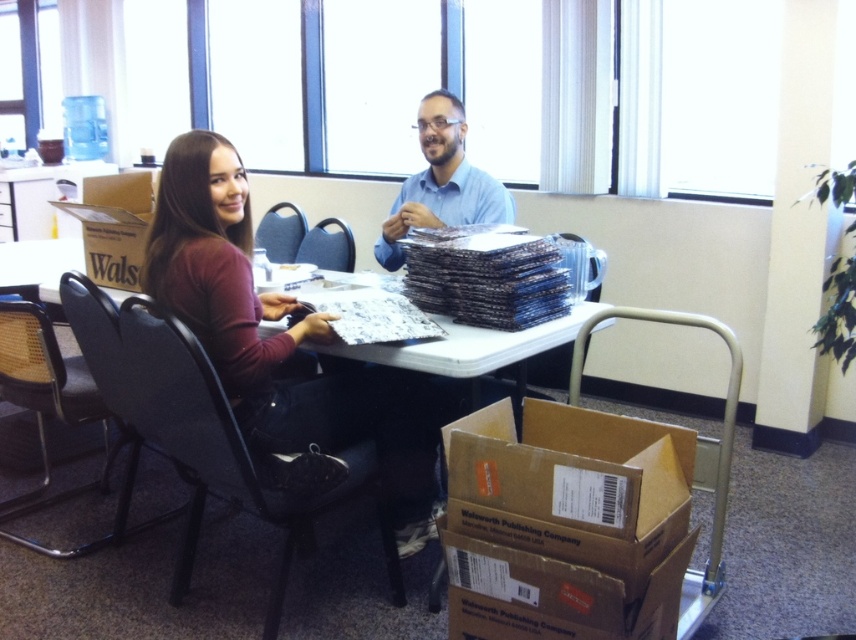
From the picture: You are standing in the office and want to reach a specific point marked at coordinates point (x=259, y=346). The office has a door 8 feet away from your current position. Can you walk directly to the point without needing to go through the door?

The distance of point (x=259, y=346) from viewer is 6.54 feet, so yes, you can walk directly to the point without needing to go through the door since it is closer than the door.

You are a delivery person who just arrived at an office. You need to place a new brown cardboard box at lower right onto the brown cardboard table at center. Can you easily move the box from its current position to the table without moving any other objects?

The brown cardboard box at lower right is closer to the viewer than the brown cardboard table at center, so it is likely positioned in front of the table. This means you can easily move the box from its current position to the table without needing to move other objects since it is already in front and accessible.